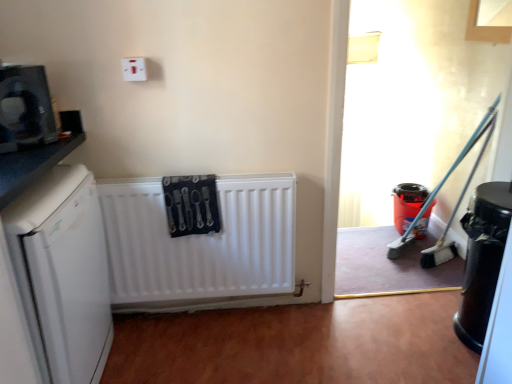
Identify the location of free region under matte black microwave at upper left, which is the first appliance in left-to-right order (from a real-world perspective). (23, 145).